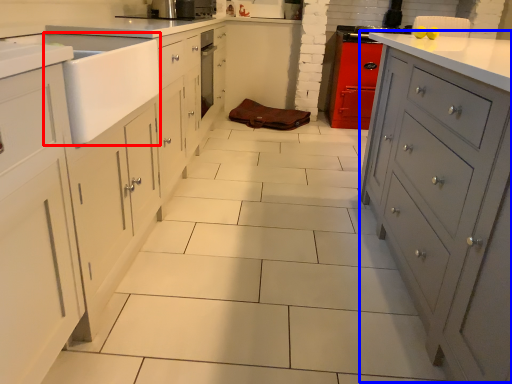
Question: Which object is further to the camera taking this photo, sink (highlighted by a red box) or file cabinet (highlighted by a blue box)?

Choices:
 (A) sink
 (B) file cabinet

Answer: (A)